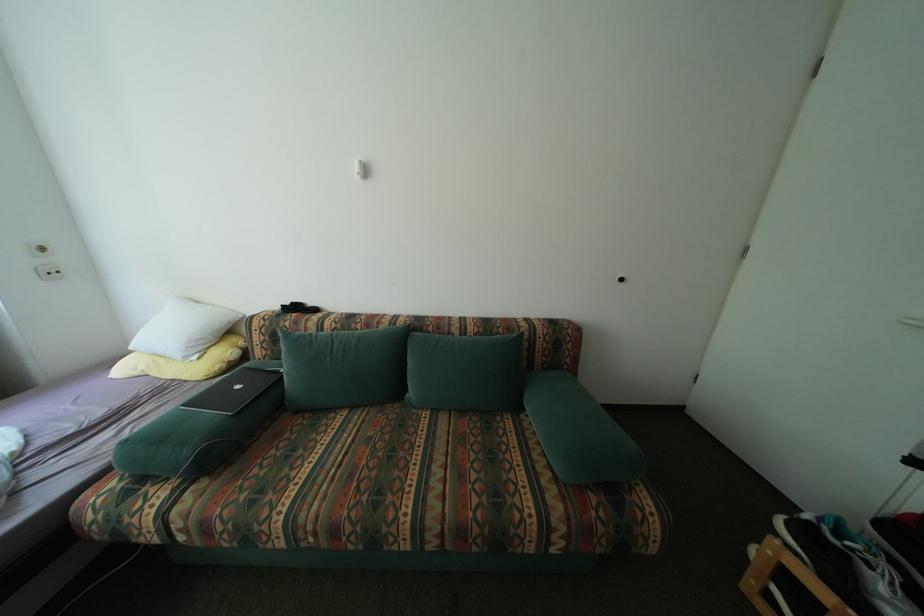
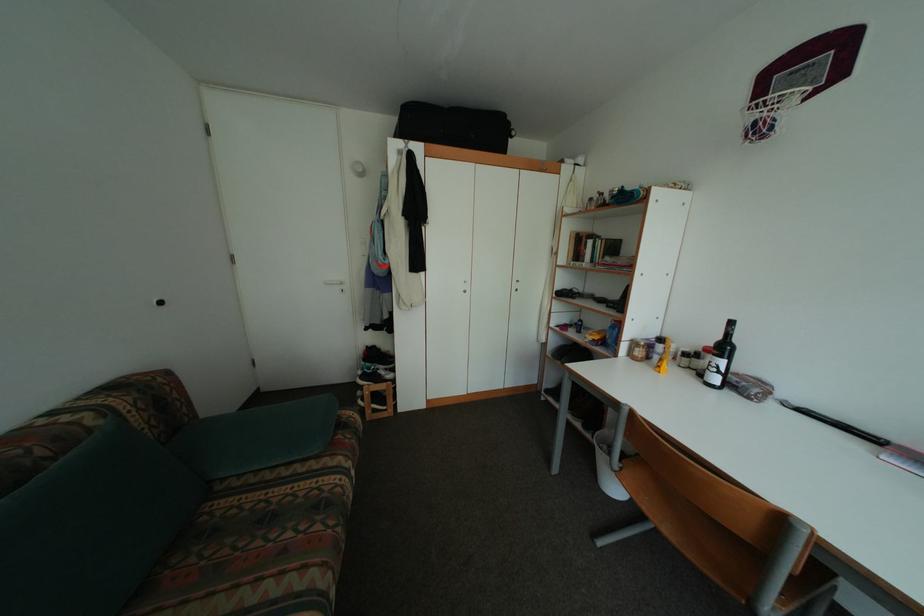
The first image is from the beginning of the video and the second image is from the end. How did the camera likely rotate when shooting the video?

The camera's rotation is toward right-down.